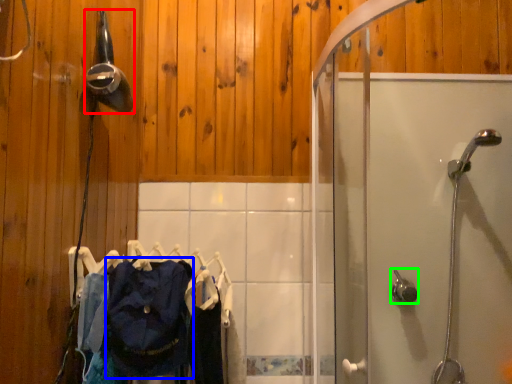
Question: Which is farther away from shower (highlighted by a red box)? clothing (highlighted by a blue box) or shower (highlighted by a green box)?

Choices:
 (A) clothing
 (B) shower

Answer: (B)